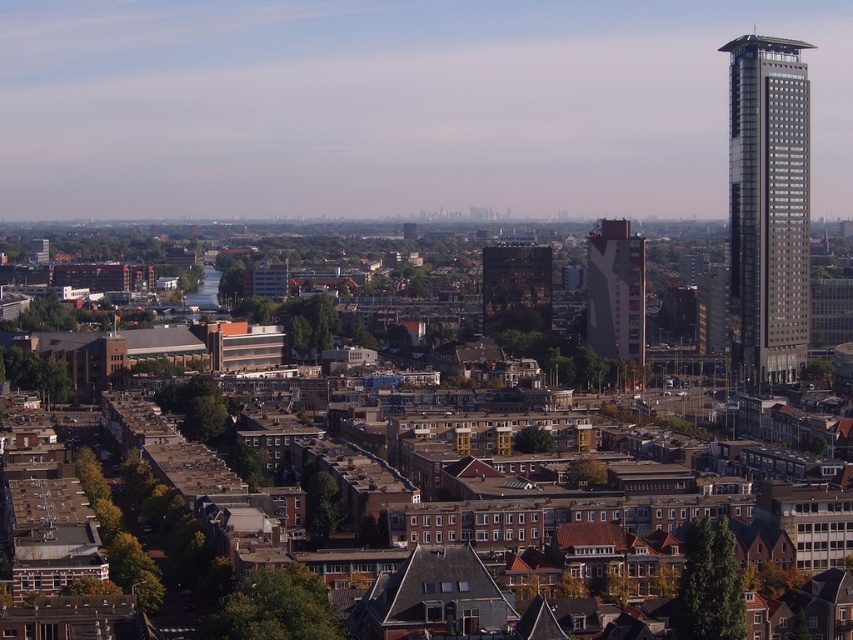
Question: Which of the following is the closest to the observer?

Choices:
 (A) silver metallic skyscraper at right
 (B) red brick building at center
 (C) dark brown brick building at center

Answer: (A)

Question: Is silver metallic skyscraper at right to the right of dark brown brick building at center from the viewer's perspective?

Choices:
 (A) yes
 (B) no

Answer: (A)

Question: Which object appears closest to the camera in this image?

Choices:
 (A) dark brown brick building at center
 (B) silver metallic skyscraper at right

Answer: (B)

Question: In this image, where is silver metallic skyscraper at right located relative to dark brown brick building at center?

Choices:
 (A) left
 (B) right

Answer: (B)

Question: Observing the image, what is the correct spatial positioning of silver metallic skyscraper at right in reference to dark brown brick building at center?

Choices:
 (A) left
 (B) right

Answer: (B)

Question: Which object appears closest to the camera in this image?

Choices:
 (A) silver metallic skyscraper at right
 (B) red brick building at center

Answer: (A)